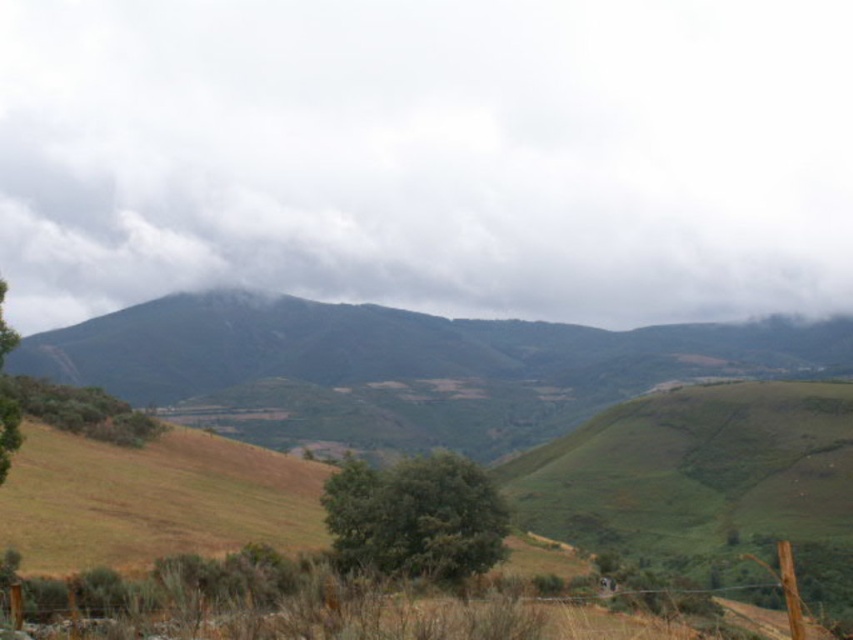
In the scene shown: You are a hiker navigating through the landscape shown in the image. You need to reach the point at coordinates point (161, 285) from the point at coordinates point (343, 532). Which direction should you move relative to your starting position?

You should move towards the background direction since point (161, 285) is behind point (343, 532) in the image.